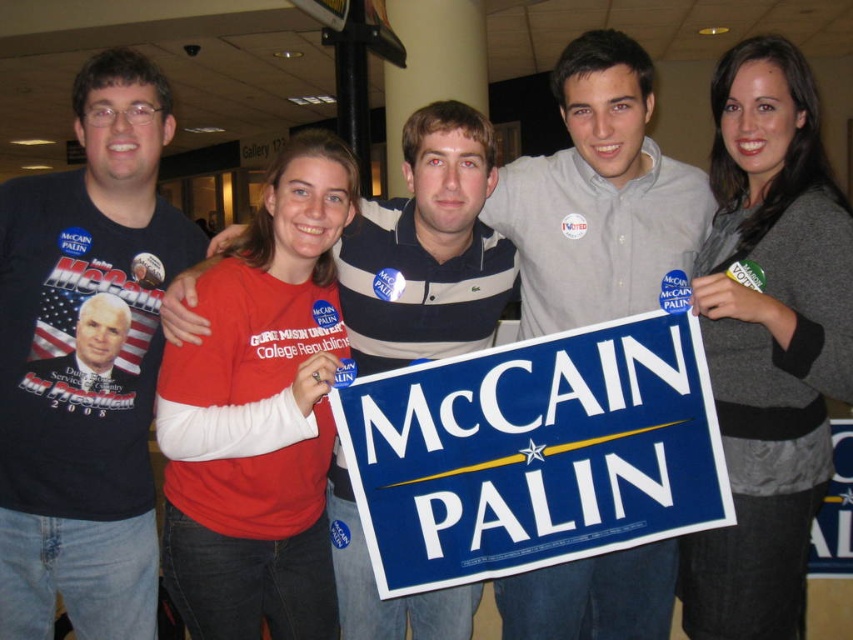
You are at a political event and want to take a photo of the blue plastic sign at center without the gray sweater at upper right blocking it. How should you adjust your position?

Move your position downward so that the blue plastic sign at center is no longer under the gray sweater at upper right.